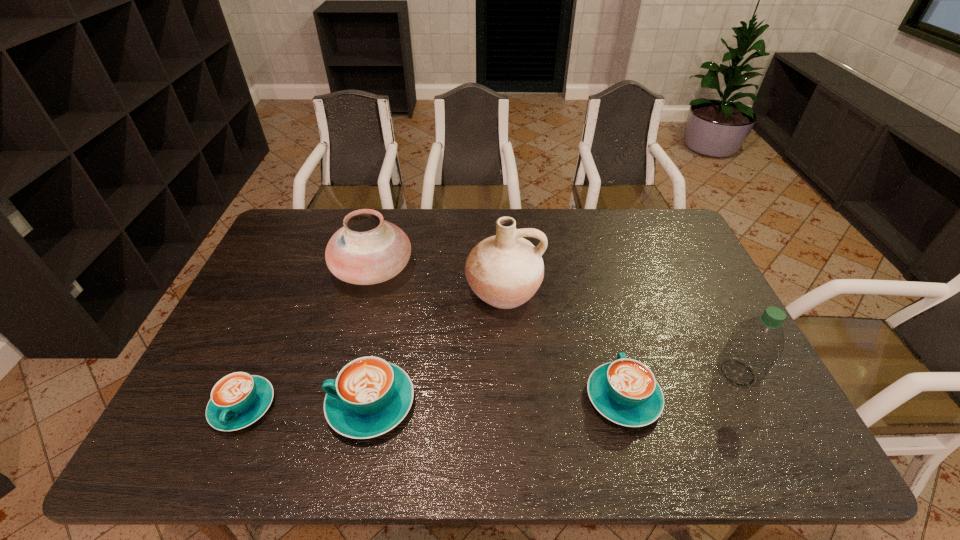
To make them evenly spaced by inserting another cappuccino among them, please locate a free space for this new cappuccino. Please provide its 2D coordinates. Your answer should be formatted as a tuple, i.e. [(x, y)], where the tuple contains the x and y coordinates of a point satisfying the conditions above.

[(498, 401)]